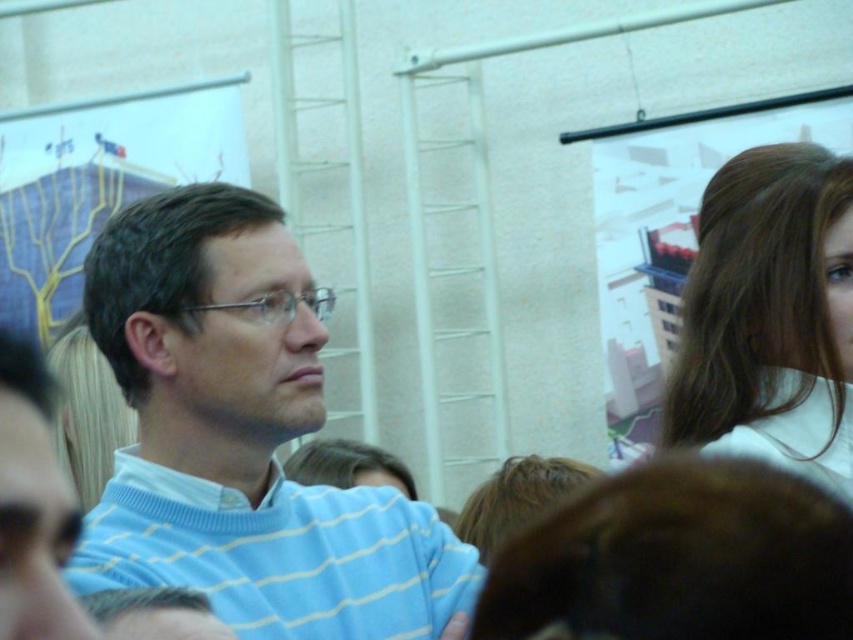
Question: Which object appears farthest from the camera in this image?

Choices:
 (A) light blue striped sweater at center
 (B) brown hair at upper right

Answer: (B)

Question: Is light blue striped sweater at center above brown hair at upper right?

Choices:
 (A) no
 (B) yes

Answer: (A)

Question: Does light blue striped sweater at center appear over brown hair at upper right?

Choices:
 (A) no
 (B) yes

Answer: (A)

Question: Where is light blue striped sweater at center located in relation to brown hair at upper right in the image?

Choices:
 (A) right
 (B) left

Answer: (B)